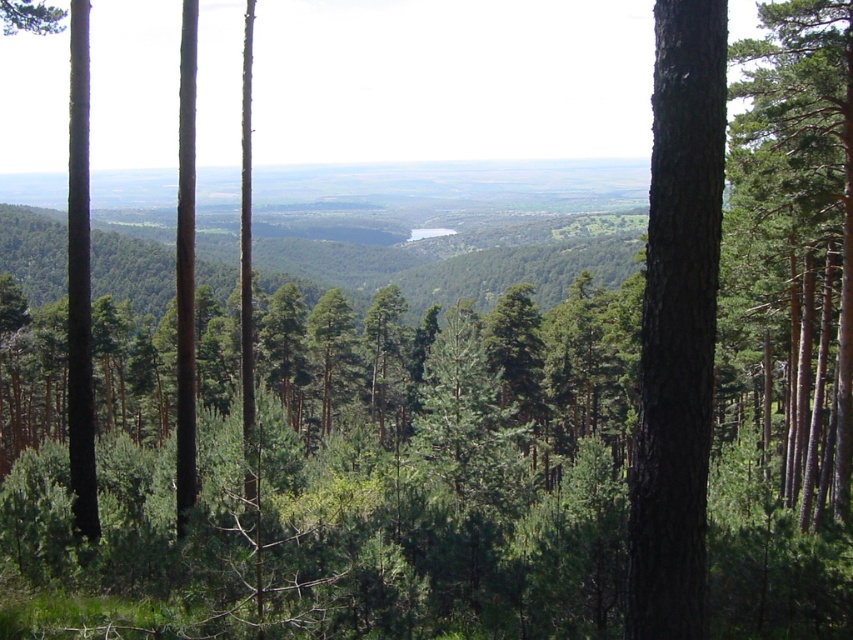
You are an ornithologist observing this forest scene. You notice two trees at the right side of the image. Which tree is closer to you, the brown rough bark tree at right or the green matte tree at right?

The brown rough bark tree at right is closer to you because it is positioned in front of the green matte tree at right.

Consider the image. You are a hiker trying to navigate through the forest. You have two landmarks marked on your map at coordinates point (701,208) and point (793,193). Which of these landmarks is closer to your current position at the vantage point?

Point (701,208) is closer to the camera than point (793,193), so the landmark at point (701,208) is closer to your current position at the vantage point.